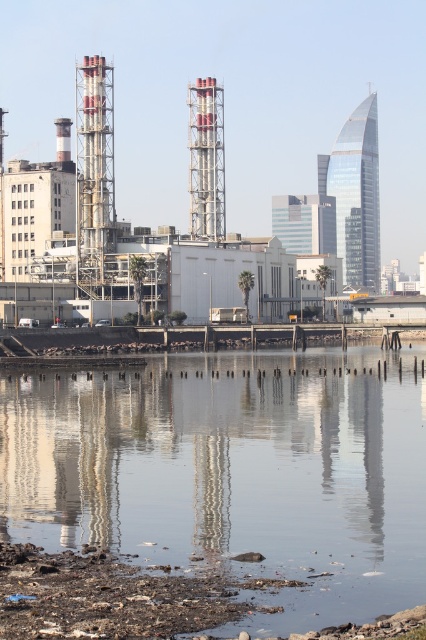
Is point (189, 531) positioned behind point (206, 236)?

No, it is not.

Does transparent water at center have a larger size compared to matte gray industrial structure at center?

A: Incorrect, transparent water at center is not larger than matte gray industrial structure at center.

Which is in front, point (74, 460) or point (180, 266)?

Point (74, 460)

Locate an element on the screen. The image size is (426, 640). transparent water at center is located at coordinates (233, 468).